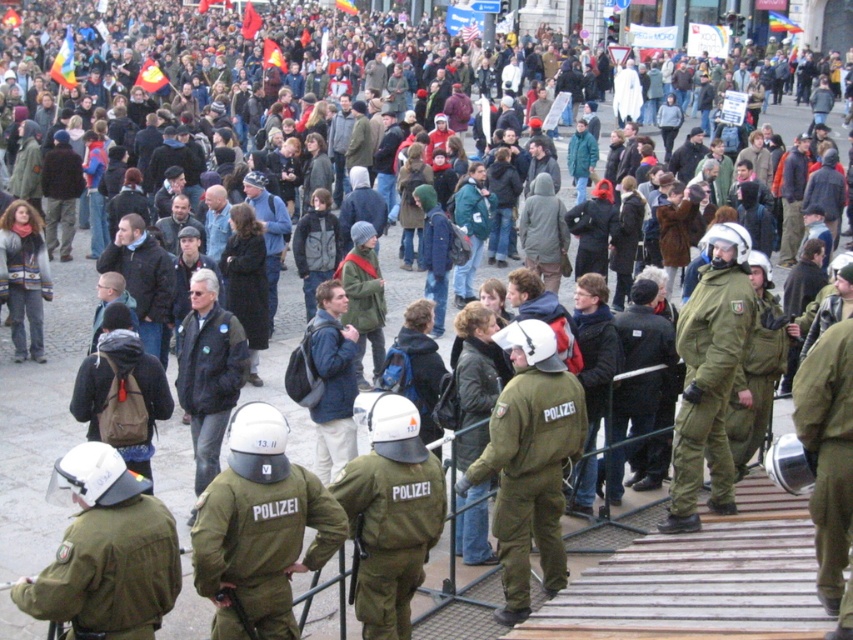
Who is taller, green uniformed officer at center or dark blue leather jacket at center?

dark blue leather jacket at center

The width and height of the screenshot is (853, 640). What do you see at coordinates (709, 376) in the screenshot?
I see `green uniformed officer at center` at bounding box center [709, 376].

Identify the location of green uniformed officer at center. This screenshot has height=640, width=853. (709, 376).

Is green uniformed officer at center shorter than dark blue jacket at center?

Yes.

Which is in front, point (699, 474) or point (128, 221)?

Positioned in front is point (699, 474).

Find the location of `green uniformed officer at center`. green uniformed officer at center is located at coordinates (709, 376).

Who is positioned more to the left, green uniformed officer at center or blue fabric backpack at center?

Positioned to the left is blue fabric backpack at center.

Which is more to the right, green uniformed officer at center or blue fabric backpack at center?

green uniformed officer at center is more to the right.

Where is `green uniformed officer at center`? Image resolution: width=853 pixels, height=640 pixels. green uniformed officer at center is located at coordinates (709, 376).